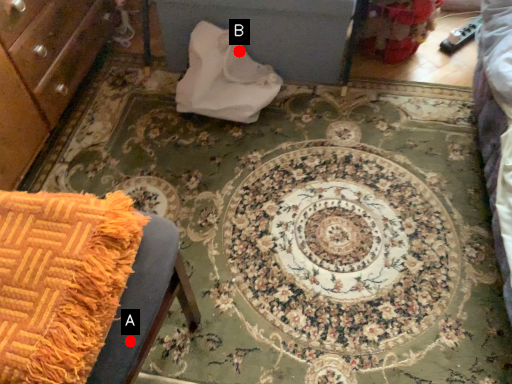
Question: Two points are circled on the image, labeled by A and B beside each circle. Which point is closer to the camera taking this photo?

Choices:
 (A) A is closer
 (B) B is closer

Answer: (A)